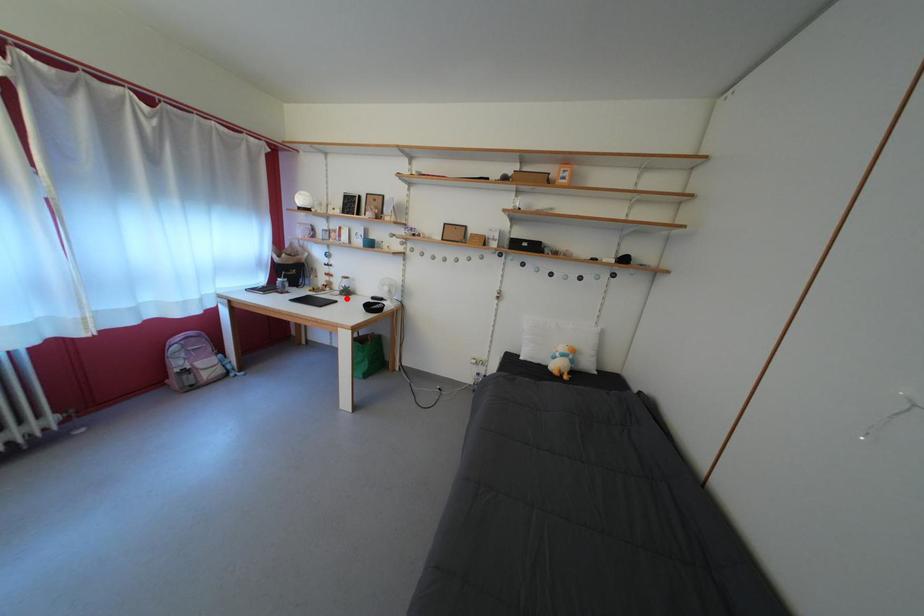
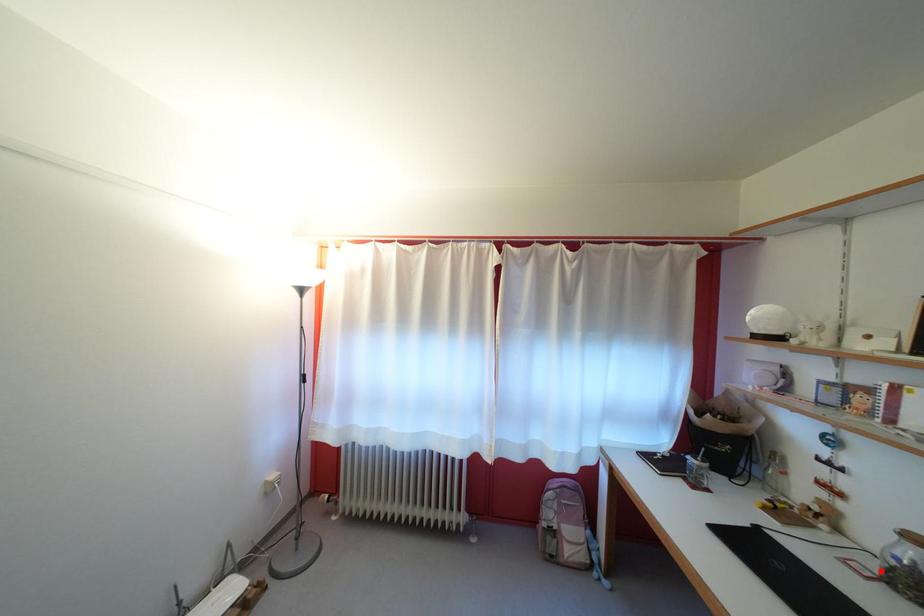
I am providing you with two images of the same scene from different viewpoints. A red point is marked on the first image and another point is marked on the second image. Is the marked point in image1 the same physical position as the marked point in image2?

Yes